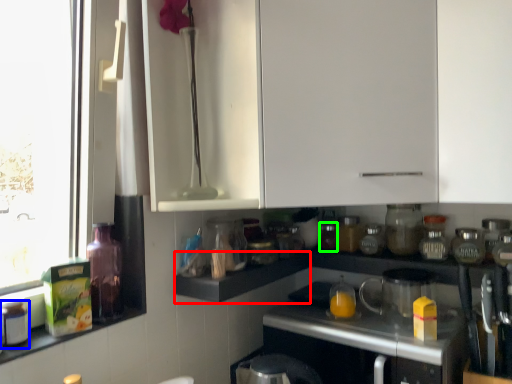
Question: Which object is the closest to the shelf (highlighted by a red box)? Choose among these: bottle (highlighted by a blue box) or bottle (highlighted by a green box).

Choices:
 (A) bottle
 (B) bottle

Answer: (B)